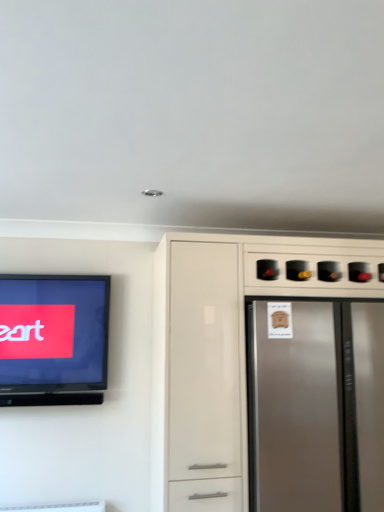
Question: Can we say satin silver refrigerator at right lies outside matte black television at left?

Choices:
 (A) yes
 (B) no

Answer: (A)

Question: From the image's perspective, is satin silver refrigerator at right above matte black television at left?

Choices:
 (A) no
 (B) yes

Answer: (A)

Question: Could you tell me if satin silver refrigerator at right is turned towards matte black television at left?

Choices:
 (A) no
 (B) yes

Answer: (A)

Question: Is satin silver refrigerator at right not close to matte black television at left?

Choices:
 (A) no
 (B) yes

Answer: (B)

Question: Considering the relative positions of satin silver refrigerator at right and matte black television at left in the image provided, is satin silver refrigerator at right to the left of matte black television at left from the viewer's perspective?

Choices:
 (A) yes
 (B) no

Answer: (B)

Question: From the image's perspective, relative to satin silver refrigerator at right, is matte black television at left above or below?

Choices:
 (A) above
 (B) below

Answer: (A)

Question: Considering the positions of point (24, 330) and point (326, 493), is point (24, 330) closer or farther from the camera than point (326, 493)?

Choices:
 (A) farther
 (B) closer

Answer: (A)

Question: From a real-world perspective, is matte black television at left positioned above or below satin silver refrigerator at right?

Choices:
 (A) above
 (B) below

Answer: (A)

Question: Is matte black television at left wider or thinner than satin silver refrigerator at right?

Choices:
 (A) wide
 (B) thin

Answer: (B)

Question: Is satin white cabinet at right bigger or smaller than matte black television at left?

Choices:
 (A) big
 (B) small

Answer: (A)

Question: From a real-world perspective, is satin white cabinet at right above or below matte black television at left?

Choices:
 (A) above
 (B) below

Answer: (B)

Question: From the image's perspective, relative to matte black television at left, is satin white cabinet at right above or below?

Choices:
 (A) above
 (B) below

Answer: (B)

Question: Is satin white cabinet at right inside or outside of matte black television at left?

Choices:
 (A) inside
 (B) outside

Answer: (B)

Question: Is point (3, 377) closer or farther from the camera than point (263, 245)?

Choices:
 (A) farther
 (B) closer

Answer: (A)

Question: Relative to satin white cabinet at right, is matte black television at left in front or behind?

Choices:
 (A) front
 (B) behind

Answer: (B)